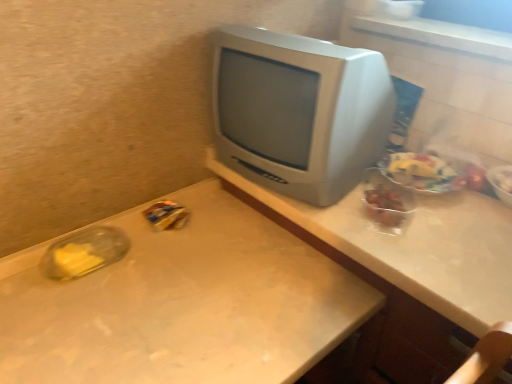
Find the location of a particular element. Image resolution: width=512 pixels, height=384 pixels. vacant space to the right of clear plastic container at left is located at coordinates (167, 262).